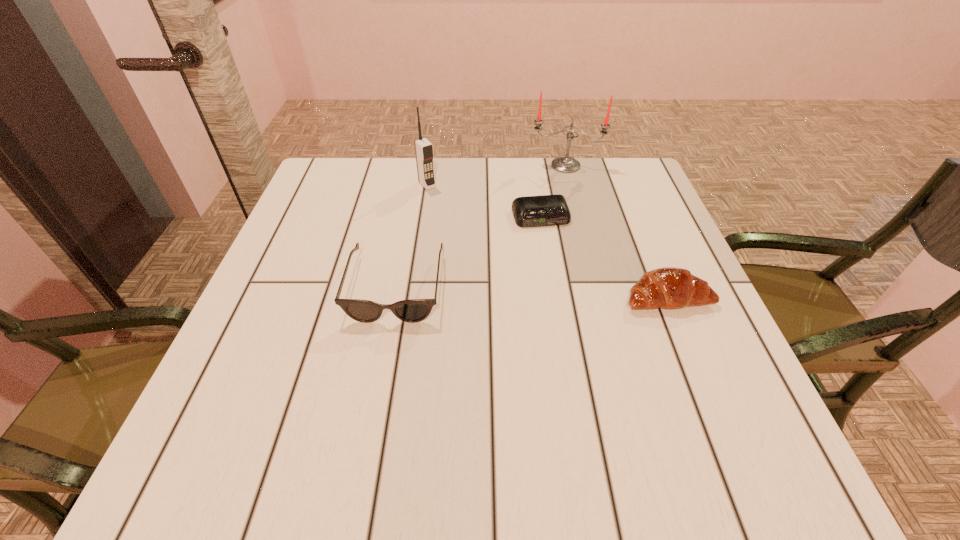
Locate an element on the screen. This screenshot has height=540, width=960. crescent roll situated at the right edge is located at coordinates (669, 287).

The image size is (960, 540). What are the coordinates of `candle present at the right edge` in the screenshot? It's located at (565, 164).

I want to click on object located in the far right corner section of the desktop, so click(x=565, y=164).

The height and width of the screenshot is (540, 960). Identify the location of vacant position at the far edge of the desktop. (x=540, y=180).

This screenshot has width=960, height=540. I want to click on vacant space at the near edge of the desktop, so click(x=618, y=401).

Locate an element on the screen. This screenshot has height=540, width=960. free space at the left edge of the desktop is located at coordinates (307, 225).

Identify the location of vacant space at the right edge of the desktop. The height and width of the screenshot is (540, 960). (684, 312).

Identify the location of free location at the far left corner. (354, 200).

I want to click on free space at the far right corner of the desktop, so click(635, 180).

At what (x,y) coordinates should I click in order to perform the action: click on free space between the candle and the cellular telephone. Please return your answer as a coordinate pair (x, y). Image resolution: width=960 pixels, height=540 pixels. Looking at the image, I should click on (496, 175).